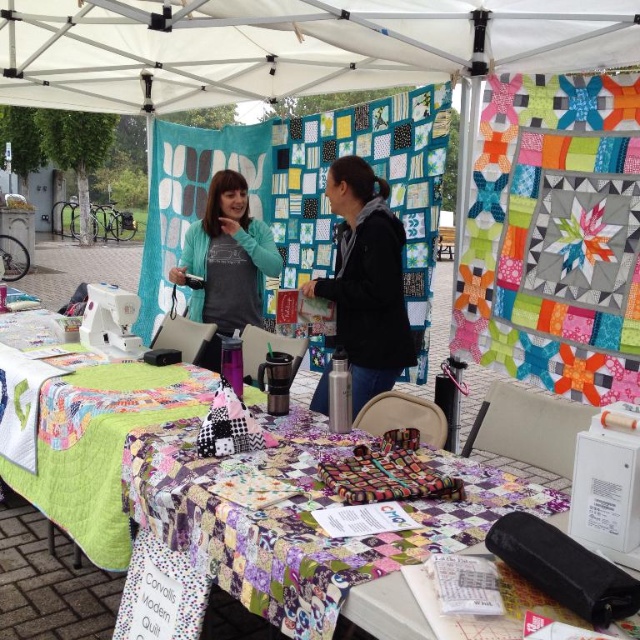
Question: Does black fleece jacket at center appear over matte teal sweater at center?

Choices:
 (A) yes
 (B) no

Answer: (B)

Question: Which point appears farthest from the camera in this image?

Choices:
 (A) (353, 580)
 (B) (230, 220)

Answer: (B)

Question: From the image, what is the correct spatial relationship of white fabric canopy at upper center in relation to matte teal sweater at center?

Choices:
 (A) above
 (B) below

Answer: (A)

Question: Among these objects, which one is farthest from the camera?

Choices:
 (A) white fabric canopy at upper center
 (B) black fleece jacket at center

Answer: (A)

Question: Is white fabric canopy at upper center to the right of patchwork fabric at center from the viewer's perspective?

Choices:
 (A) yes
 (B) no

Answer: (B)

Question: Considering the real-world distances, which object is closest to the patchwork fabric at center?

Choices:
 (A) black fleece jacket at center
 (B) matte teal sweater at center

Answer: (A)